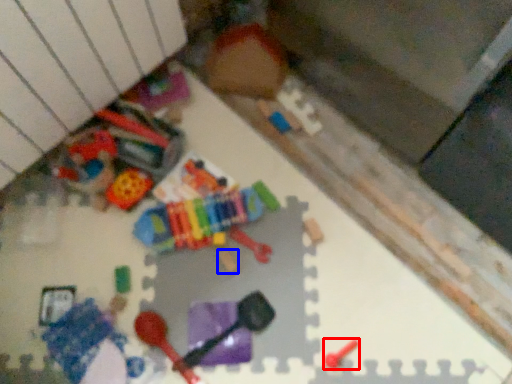
Question: Which of the following is the closest to the observer, toy (highlighted by a red box) or toy (highlighted by a blue box)?

Choices:
 (A) toy
 (B) toy

Answer: (A)